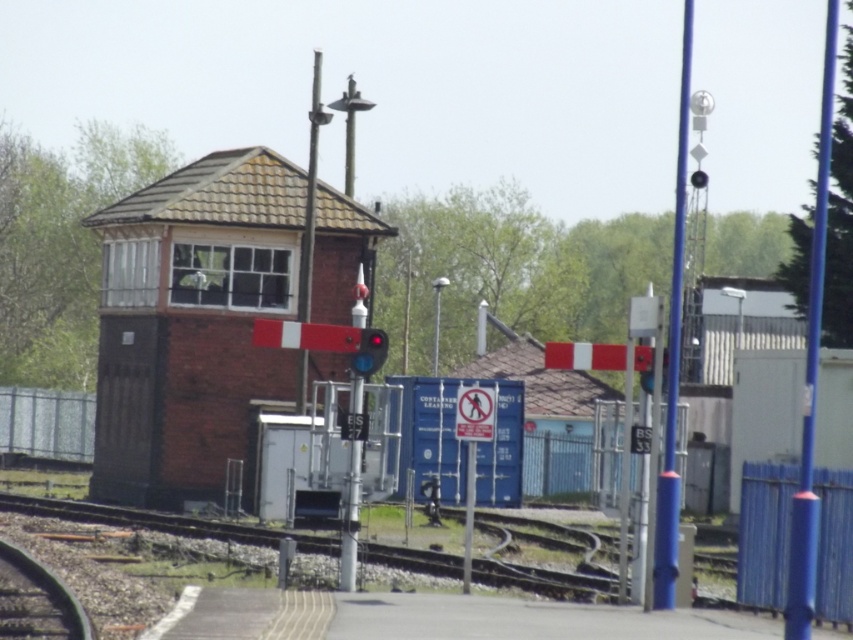
Question: Is brick textured railway signal at center smaller than smooth metal rail at lower left?

Choices:
 (A) yes
 (B) no

Answer: (B)

Question: Can you confirm if brick textured railway signal at center is wider than red glass traffic light at center?

Choices:
 (A) no
 (B) yes

Answer: (B)

Question: Which object appears closest to the camera in this image?

Choices:
 (A) red glass traffic light at center
 (B) smooth metal rail at lower left
 (C) brick textured railway signal at center

Answer: (B)

Question: Can you confirm if brick textured railway signal at center is bigger than smooth metal rail at lower left?

Choices:
 (A) no
 (B) yes

Answer: (B)

Question: Which point is farther to the camera?

Choices:
 (A) brick textured railway signal at center
 (B) red glass traffic light at center

Answer: (A)

Question: Which object is the farthest from the red glass traffic light at center?

Choices:
 (A) brick textured railway signal at center
 (B) smooth metal rail at lower left

Answer: (A)